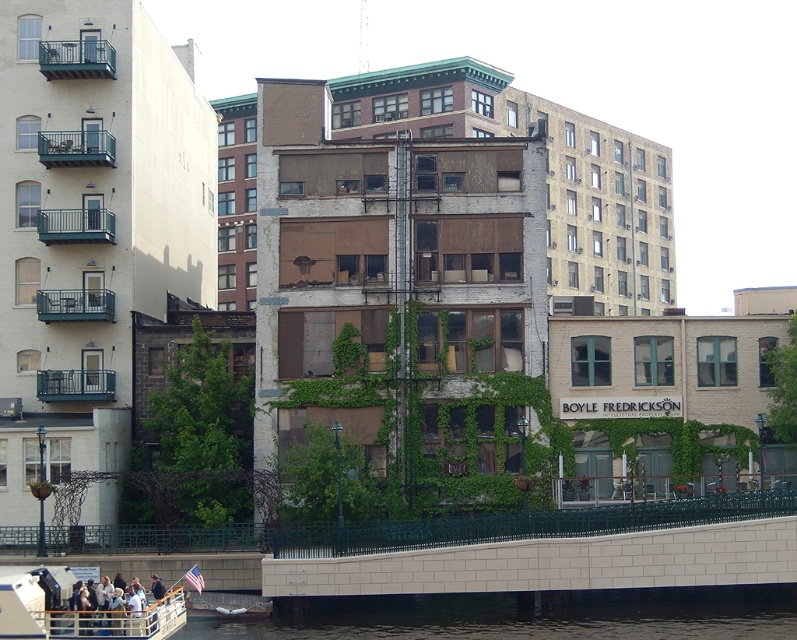
Can you confirm if black concrete water at lower center is wider than white plastic boat at lower left?

Yes, black concrete water at lower center is wider than white plastic boat at lower left.

Is point (591, 627) behind point (175, 605)?

That is True.

Who is more forward, (350, 604) or (77, 636)?

Positioned in front is point (77, 636).

This screenshot has height=640, width=797. I want to click on black concrete water at lower center, so click(525, 616).